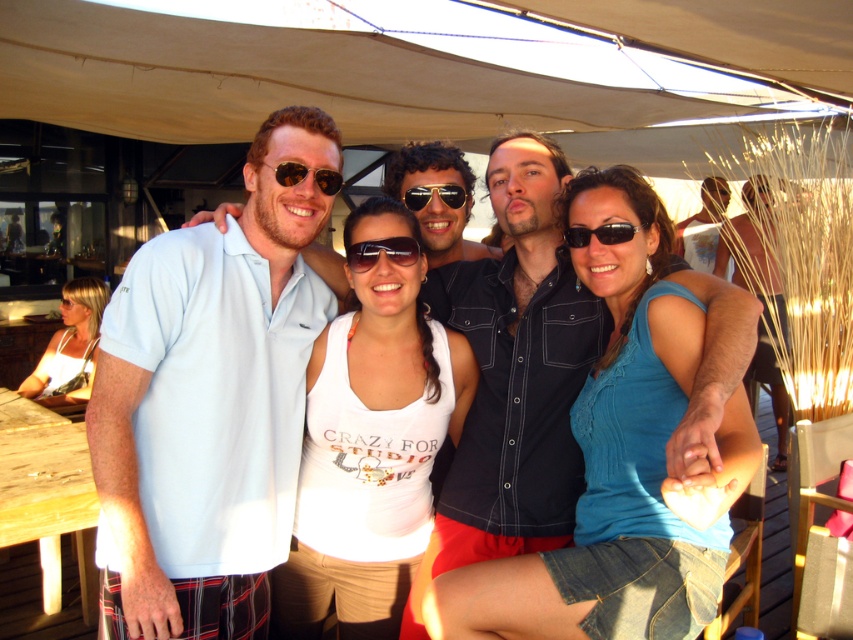
Question: Is beige fabric canopy at upper center above matte white tank top at lower left?

Choices:
 (A) no
 (B) yes

Answer: (B)

Question: Can you confirm if matte white tank top at lower left is positioned below sunglasses at center?

Choices:
 (A) no
 (B) yes

Answer: (B)

Question: From the image, what is the correct spatial relationship of sunglasses at center in relation to black matte sunglasses at center?

Choices:
 (A) above
 (B) below

Answer: (A)

Question: Which point is closer to the camera?

Choices:
 (A) beige fabric canopy at upper center
 (B) sunglasses at center
 (C) matte white tank top at lower left

Answer: (A)

Question: Estimate the real-world distances between objects in this image. Which object is farther from the white tank top at center?

Choices:
 (A) blue denim shorts at center
 (B) beige fabric canopy at upper center
 (C) black plastic sunglasses at center
 (D) black matte sunglasses at center

Answer: (B)

Question: Which object appears farthest from the camera in this image?

Choices:
 (A) sunglasses at center
 (B) white tank top at center
 (C) black matte sunglasses at center

Answer: (A)